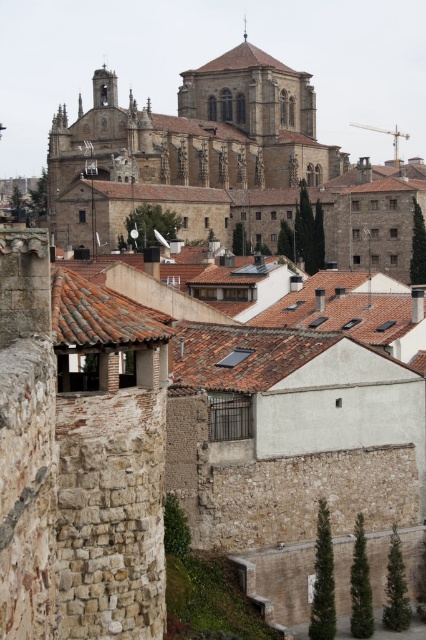
You are an architect analyzing the historic urban landscape. Based on the scene, which object has a greater width between the brown stone church at upper center and the terracotta tile roof at center?

The brown stone church at upper center has a greater width than the terracotta tile roof at center.

You are an architect analyzing the urban layout of this historic city. Based on the image, which object, the brown stone church at upper center or the terracotta tile roof at center, has a greater vertical height?

The brown stone church at upper center is taller than the terracotta tile roof at center.